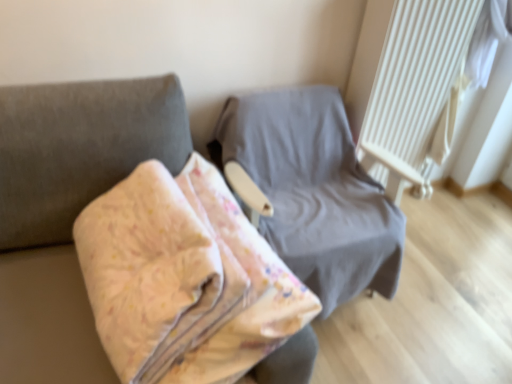
Question: Which direction should I rotate to look at gray fabric chair at center, the 1th furniture in the back-to-front sequence?

Choices:
 (A) left
 (B) right

Answer: (B)

Question: Are gray fabric chair at center, the 2th furniture from the front, and white textured radiator at upper right beside each other?

Choices:
 (A) yes
 (B) no

Answer: (B)

Question: Can you confirm if gray fabric chair at center, the 1th furniture in the back-to-front sequence, is positioned to the right of white textured radiator at upper right?

Choices:
 (A) no
 (B) yes

Answer: (A)

Question: Is gray fabric chair at center, the 2th furniture from the front, positioned far away from white textured radiator at upper right?

Choices:
 (A) no
 (B) yes

Answer: (A)

Question: Is gray fabric chair at center, the 1th furniture in the back-to-front sequence, turned away from white textured radiator at upper right?

Choices:
 (A) no
 (B) yes

Answer: (B)

Question: From the image's perspective, is gray fabric chair at center, the 2th furniture from the front, below white textured radiator at upper right?

Choices:
 (A) no
 (B) yes

Answer: (B)

Question: Is the position of gray fabric chair at center, the 1th furniture in the back-to-front sequence, more distant than that of white textured radiator at upper right?

Choices:
 (A) yes
 (B) no

Answer: (B)

Question: Does floral fabric blanket at center, the 1th furniture when ordered from front to back, have a greater height compared to gray fabric chair at center, the 2th furniture from the front?

Choices:
 (A) no
 (B) yes

Answer: (A)

Question: Is floral fabric blanket at center, arranged as the second furniture when viewed from the back, further to the viewer compared to gray fabric chair at center, the 1th furniture in the back-to-front sequence?

Choices:
 (A) yes
 (B) no

Answer: (B)

Question: Considering the relative positions of floral fabric blanket at center, the 1th furniture when ordered from front to back, and gray fabric chair at center, the 2th furniture from the front, in the image provided, is floral fabric blanket at center, the 1th furniture when ordered from front to back, to the left of gray fabric chair at center, the 2th furniture from the front, from the viewer's perspective?

Choices:
 (A) yes
 (B) no

Answer: (A)

Question: Is floral fabric blanket at center, arranged as the second furniture when viewed from the back, not near gray fabric chair at center, the 1th furniture in the back-to-front sequence?

Choices:
 (A) yes
 (B) no

Answer: (B)

Question: Can you confirm if floral fabric blanket at center, the 1th furniture when ordered from front to back, is positioned to the right of gray fabric chair at center, the 2th furniture from the front?

Choices:
 (A) yes
 (B) no

Answer: (B)

Question: Is floral fabric blanket at center, arranged as the second furniture when viewed from the back, bigger than gray fabric chair at center, the 1th furniture in the back-to-front sequence?

Choices:
 (A) no
 (B) yes

Answer: (A)

Question: Is gray fabric chair at center, the 2th furniture from the front, oriented towards floral fabric blanket at center, arranged as the second furniture when viewed from the back?

Choices:
 (A) no
 (B) yes

Answer: (B)